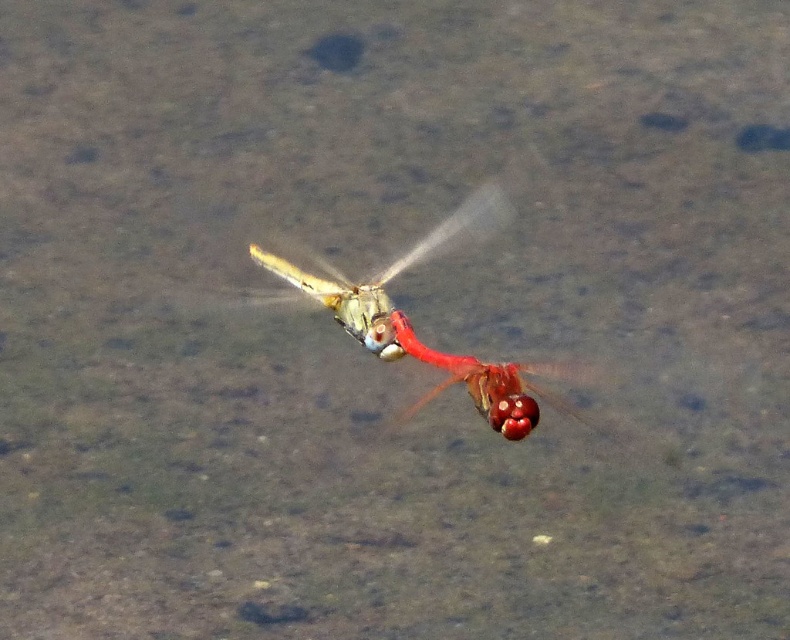
You are a nature photographer aiming to capture the translucent glass dragonfly at center and the glossy red dragonfly at center in a single shot. Given that your camera can only focus on one dragonfly at a time, which dragonfly should you focus on to ensure the other remains in the background?

The translucent glass dragonfly at center is larger in size than the glossy red dragonfly at center. To ensure the glossy red dragonfly at center stays in the background, focus on the translucent glass dragonfly at center since it is closer to the camera.